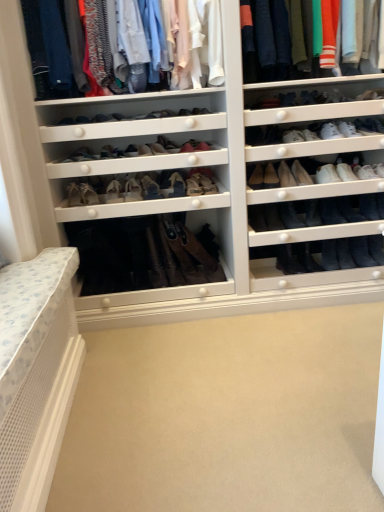
Question: Is the position of leather tan boot at center, the 14th shoe in the right-to-left sequence, more distant than that of black leather boot at lower right, the 7th shoe when ordered from right to left?

Choices:
 (A) yes
 (B) no

Answer: (B)

Question: Could black leather boot at lower right, which is counted as the fifteenth shoe, starting from the left, be considered to be inside leather tan boot at center, the 14th shoe in the right-to-left sequence?

Choices:
 (A) yes
 (B) no

Answer: (B)

Question: From the image's perspective, is leather tan boot at center, the 14th shoe in the right-to-left sequence, below black leather boot at lower right, which is counted as the fifteenth shoe, starting from the left?

Choices:
 (A) no
 (B) yes

Answer: (A)

Question: Does leather tan boot at center, which ranks as the 8th shoe in left-to-right order, come in front of black leather boot at lower right, which is counted as the fifteenth shoe, starting from the left?

Choices:
 (A) no
 (B) yes

Answer: (B)

Question: From a real-world perspective, is leather tan boot at center, the 14th shoe in the right-to-left sequence, beneath black leather boot at lower right, which is counted as the fifteenth shoe, starting from the left?

Choices:
 (A) no
 (B) yes

Answer: (A)

Question: Which is correct: matte beige shoe at center, marked as the 6th shoe in a left-to-right arrangement, is inside white leather sneaker at upper right, positioned as the eighteenth shoe in left-to-right order, or outside of it?

Choices:
 (A) outside
 (B) inside

Answer: (A)

Question: Considering the positions of matte beige shoe at center, marked as the 6th shoe in a left-to-right arrangement, and white leather sneaker at upper right, positioned as the eighteenth shoe in left-to-right order, in the image, is matte beige shoe at center, marked as the 6th shoe in a left-to-right arrangement, taller or shorter than white leather sneaker at upper right, positioned as the eighteenth shoe in left-to-right order,?

Choices:
 (A) tall
 (B) short

Answer: (A)

Question: Is matte beige shoe at center, which ranks as the sixteenth shoe in right-to-left order, to the left or to the right of white leather sneaker at upper right, acting as the 4th shoe starting from the right, in the image?

Choices:
 (A) left
 (B) right

Answer: (A)

Question: Considering the positions of matte beige shoe at center, marked as the 6th shoe in a left-to-right arrangement, and white leather sneaker at upper right, positioned as the eighteenth shoe in left-to-right order, in the image, is matte beige shoe at center, marked as the 6th shoe in a left-to-right arrangement, wider or thinner than white leather sneaker at upper right, positioned as the eighteenth shoe in left-to-right order,?

Choices:
 (A) wide
 (B) thin

Answer: (A)

Question: Is point (307, 221) positioned closer to the camera than point (158, 186)?

Choices:
 (A) closer
 (B) farther

Answer: (A)

Question: In terms of width, does black leather boot at center, the fourteenth shoe viewed from the left, look wider or thinner when compared to matte leather shoe at center, placed as the 17th shoe when sorted from right to left?

Choices:
 (A) wide
 (B) thin

Answer: (A)

Question: In the image, is black leather boot at center, the fourteenth shoe viewed from the left, on the left side or the right side of matte leather shoe at center, placed as the 17th shoe when sorted from right to left?

Choices:
 (A) right
 (B) left

Answer: (A)

Question: Is black leather boot at center, the fourteenth shoe viewed from the left, in front of or behind matte leather shoe at center, the 5th shoe viewed from the left, in the image?

Choices:
 (A) behind
 (B) front

Answer: (A)

Question: From a real-world perspective, is black leather boot at center-right, the 12th shoe in the left-to-right sequence, positioned above or below black leather boot at lower right, which is counted as the fifteenth shoe, starting from the left?

Choices:
 (A) above
 (B) below

Answer: (A)

Question: Is black leather boot at center-right, which ranks as the 10th shoe in right-to-left order, situated inside black leather boot at lower right, the 7th shoe when ordered from right to left, or outside?

Choices:
 (A) outside
 (B) inside

Answer: (A)